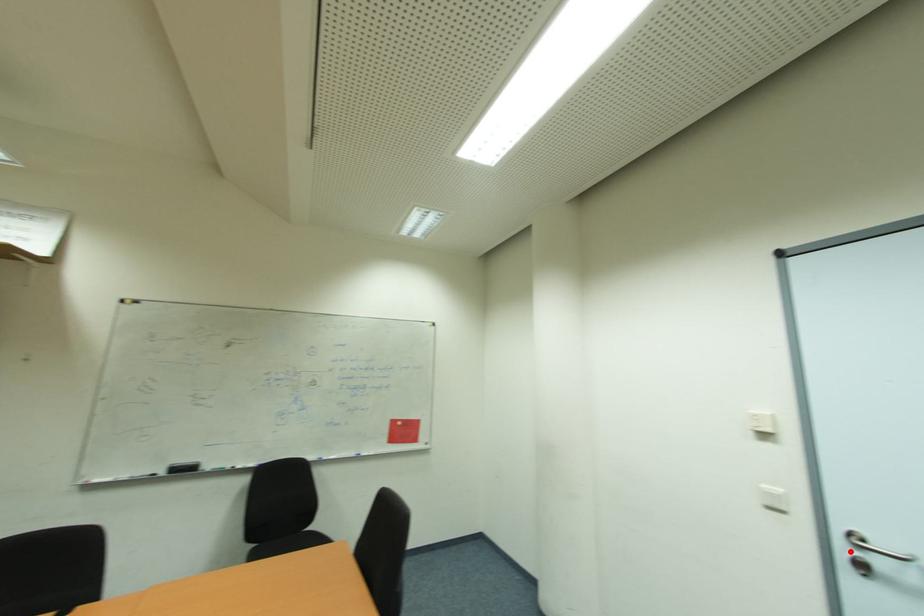
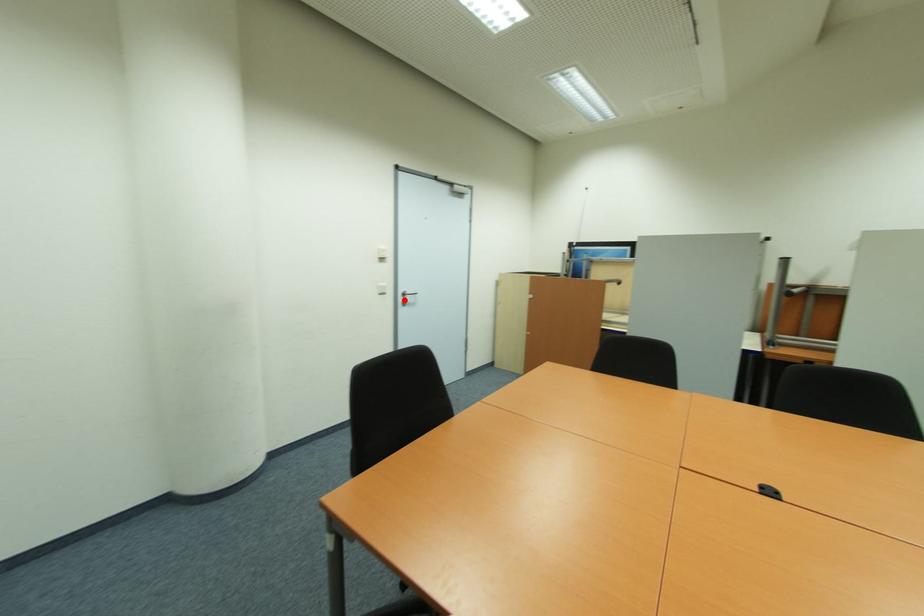
I am providing you with two images of the same scene from different viewpoints. A red point is marked on the first image and another point is marked on the second image. Is the red point in image1 aligned with the point shown in image2?

Yes